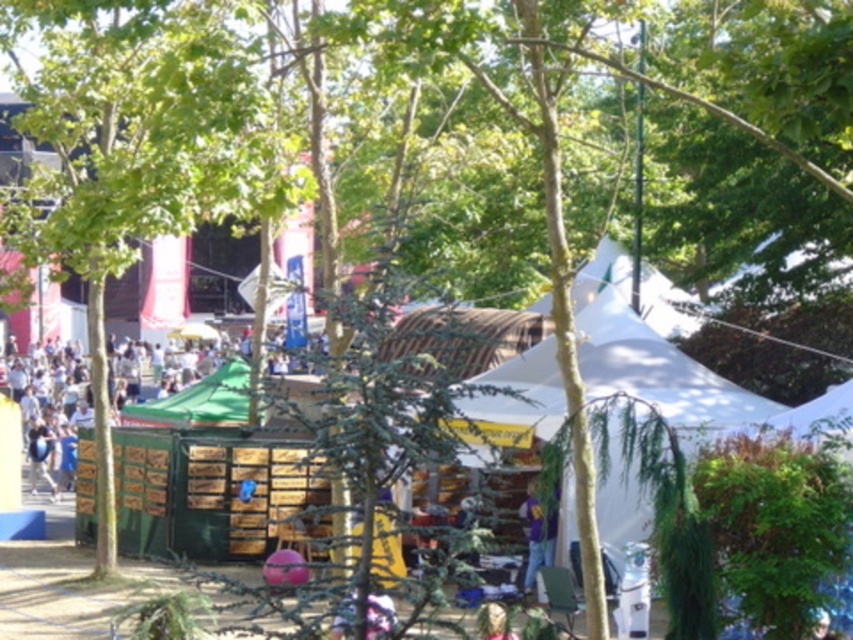
Which is more to the right, green leafy tree at left or purple matte shirt at lower center?

From the viewer's perspective, purple matte shirt at lower center appears more on the right side.

Is green leafy tree at left above purple matte shirt at lower center?

Indeed, green leafy tree at left is positioned over purple matte shirt at lower center.

Which is behind, point (50, 256) or point (554, 506)?

Point (50, 256)

Locate an element on the screen. green leafy tree at left is located at coordinates (136, 148).